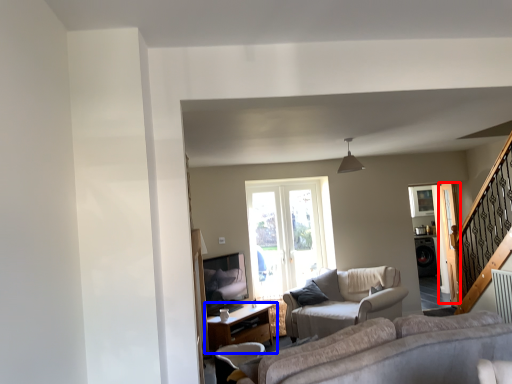
Question: Which object is closer to the camera taking this photo, screen door (highlighted by a red box) or table (highlighted by a blue box)?

Choices:
 (A) screen door
 (B) table

Answer: (B)